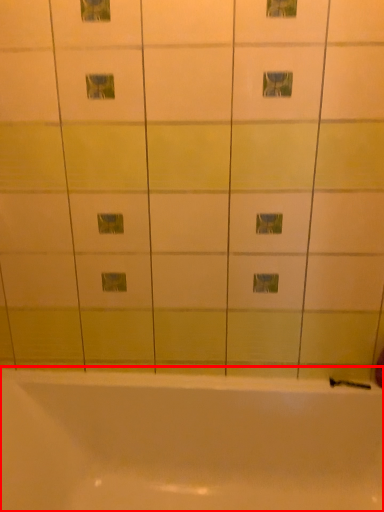
Question: From the image, what is the correct spatial relationship of bathtub (annotated by the red box) in relation to shower?

Choices:
 (A) left
 (B) right

Answer: (A)